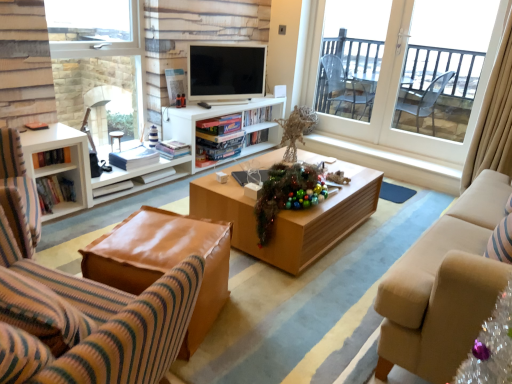
Question: In terms of size, does beige fabric curtain at right appear bigger or smaller than white matte entertainment center at center?

Choices:
 (A) big
 (B) small

Answer: (B)

Question: From a real-world perspective, relative to white matte entertainment center at center, is beige fabric curtain at right vertically above or below?

Choices:
 (A) below
 (B) above

Answer: (B)

Question: Which is farther from the matte white television at center?

Choices:
 (A) leather ottoman at lower left
 (B) wooden coffee table at center
 (C) clear glass window at left, acting as the second window starting from the right
 (D) shiny metallic garland at center
 (E) leather at left

Answer: (E)

Question: Which object is positioned farthest from the matte white television at center?

Choices:
 (A) leather ottoman at lower left
 (B) beige fabric couch at right
 (C) wooden coffee table at center
 (D) white matte entertainment center at center
 (E) beige fabric curtain at right

Answer: (B)